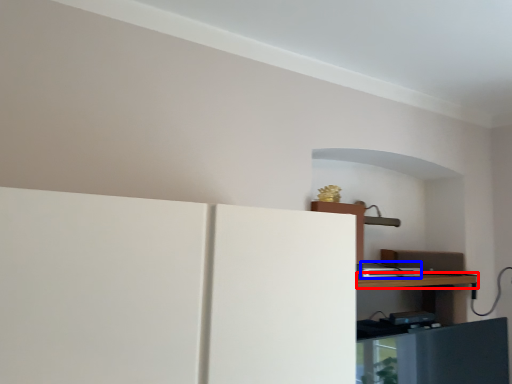
Question: Which object is closer to the camera taking this photo, table (highlighted by a red box) or appliance (highlighted by a blue box)?

Choices:
 (A) table
 (B) appliance

Answer: (A)